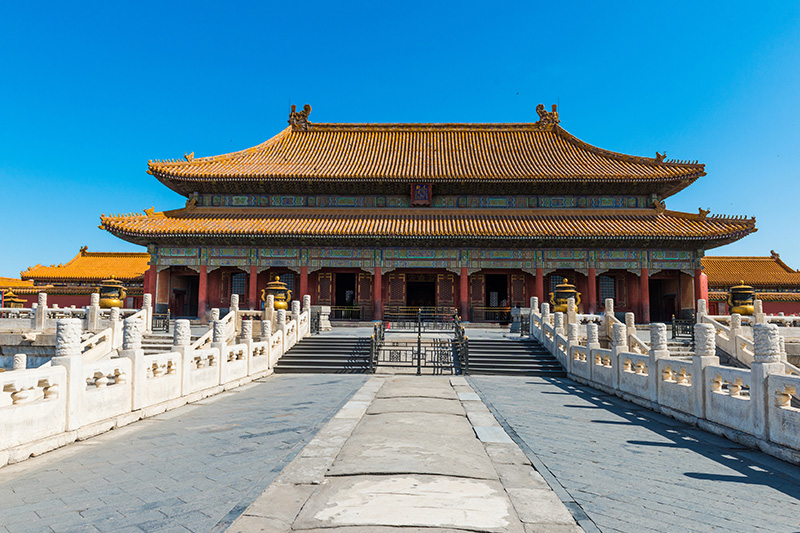
Where is `grey tiles`? grey tiles is located at coordinates (188, 452), (614, 460).